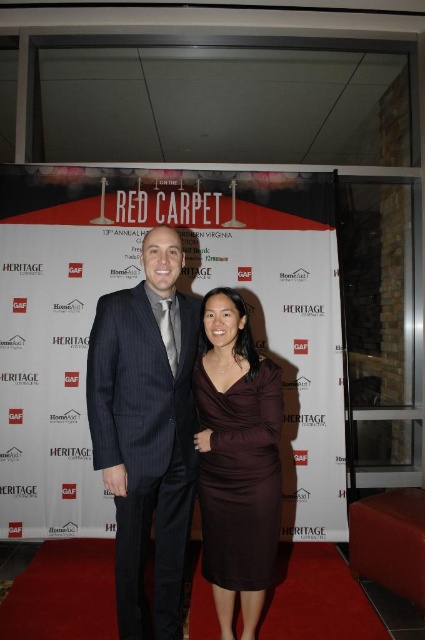
Which of these two, dark blue pinstripe suit at center or burgundy satin dress at center, stands taller?

Standing taller between the two is dark blue pinstripe suit at center.

Does dark blue pinstripe suit at center appear under burgundy satin dress at center?

Incorrect, dark blue pinstripe suit at center is not positioned below burgundy satin dress at center.

Who is more forward, (161, 579) or (237, 442)?

Positioned in front is point (237, 442).

The height and width of the screenshot is (640, 425). Find the location of `dark blue pinstripe suit at center`. dark blue pinstripe suit at center is located at coordinates (147, 429).